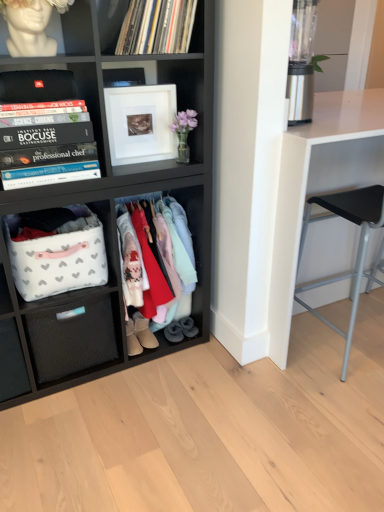
Where is `free space on the front side of gray suede boot at lower center, the third footwear from the left`? The height and width of the screenshot is (512, 384). free space on the front side of gray suede boot at lower center, the third footwear from the left is located at coordinates (169, 349).